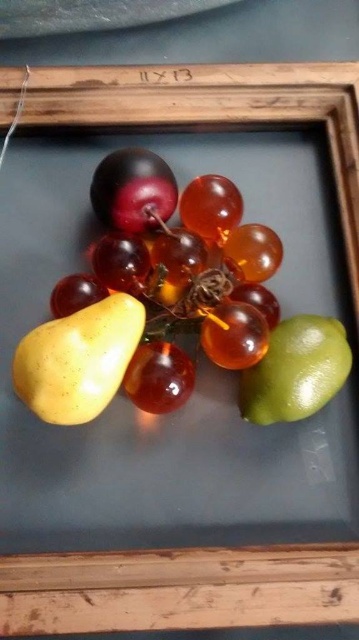
You are standing in front of the wooden frame with artificial fruits. There is a point marked at coordinates (77, 358). Which fruit is located at that point?

The point at (77, 358) corresponds to the yellow matte pear at center left.

Based on the photo, you are arranging fruits on a wooden frame and need to place the translucent amber grapes at center and the green matte lime at lower right. According to the current arrangement, which fruit is located to the left of the other?

The translucent amber grapes at center is positioned on the left side of green matte lime at lower right.